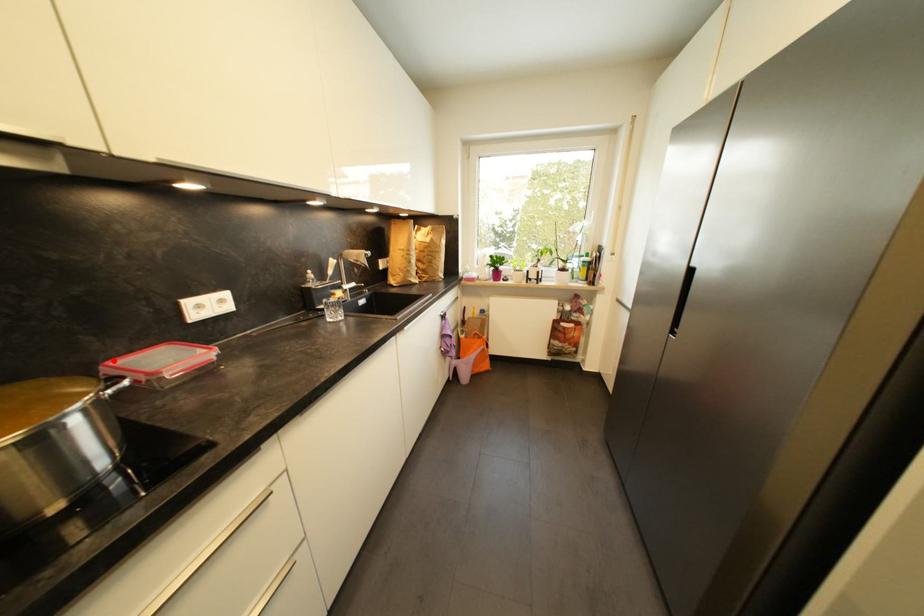
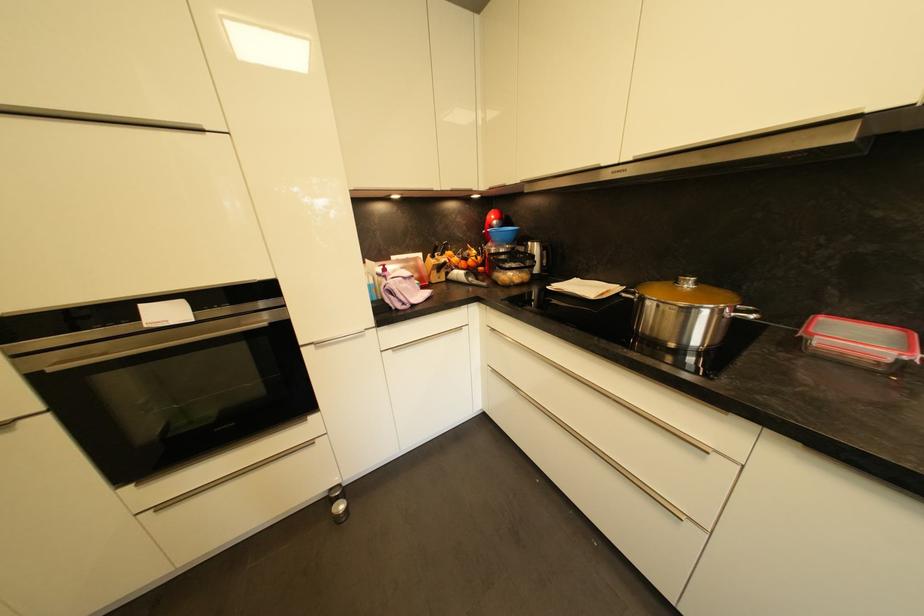
Locate, in the second image, the point that corresponds to the highlighted location in the first image.

(836, 315)